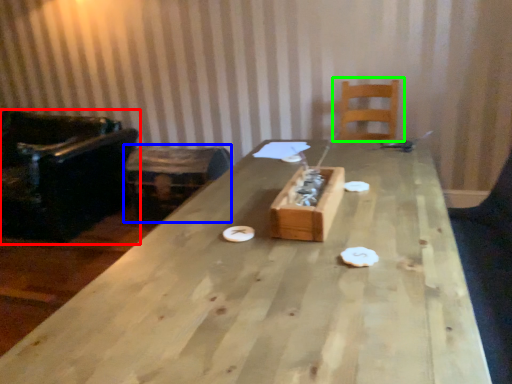
Question: Estimate the real-world distances between objects in this image. Which object is farther from chair (highlighted by a red box), storage box (highlighted by a blue box) or chair (highlighted by a green box)?

Choices:
 (A) storage box
 (B) chair

Answer: (B)